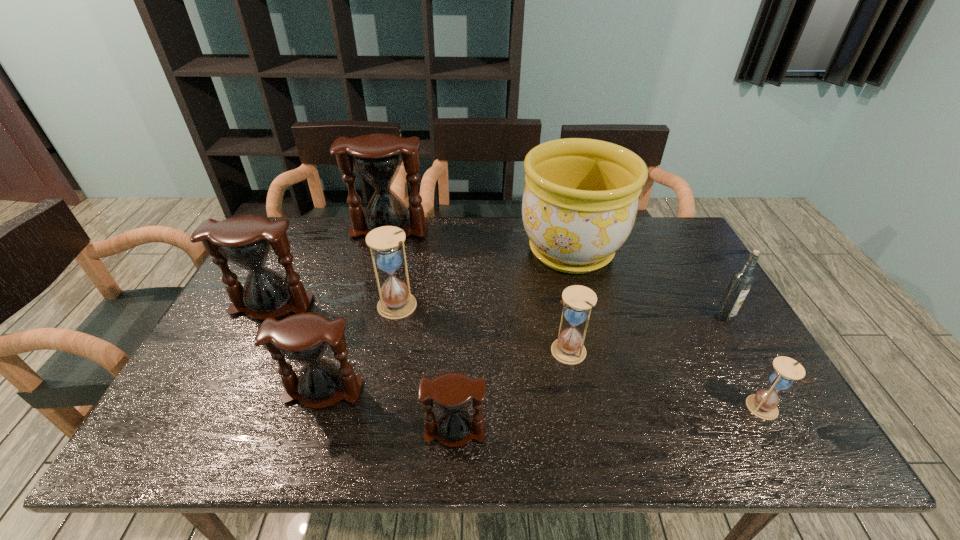
This screenshot has height=540, width=960. I want to click on the second smallest brown hourglass, so click(303, 338).

At what (x,y) coordinates should I click in order to perform the action: click on the rightmost white hourglass. Please return your answer as a coordinate pair (x, y). Image resolution: width=960 pixels, height=540 pixels. Looking at the image, I should click on (763, 404).

The height and width of the screenshot is (540, 960). Identify the location of the nearest white hourglass. (763, 404).

Find the location of `the rightmost brown hourglass`. the rightmost brown hourglass is located at coordinates (451, 392).

The image size is (960, 540). In order to click on the third hourglass from right to left in this screenshot , I will do `click(451, 392)`.

At what (x,y) coordinates should I click in order to perform the action: click on free spot located 0.340m on the front of the farthest brown hourglass. Please return your answer as a coordinate pair (x, y). Looking at the image, I should click on (366, 317).

This screenshot has height=540, width=960. Find the location of `free space located 0.380m on the front of the flowerpot`. free space located 0.380m on the front of the flowerpot is located at coordinates (608, 395).

The image size is (960, 540). I want to click on free space located 0.120m on the left of the biggest white hourglass, so click(x=335, y=306).

Where is `vacant space positioned 0.290m on the right of the third smallest brown hourglass`? vacant space positioned 0.290m on the right of the third smallest brown hourglass is located at coordinates (413, 305).

Find the location of a particular element. free region located on the label of the vodka is located at coordinates (748, 359).